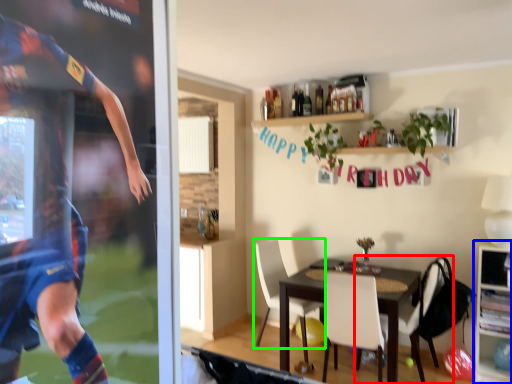
Question: Which object is the farthest from chair (highlighted by a red box)? Choose among these: cabinetry (highlighted by a blue box) or chair (highlighted by a green box).

Choices:
 (A) cabinetry
 (B) chair

Answer: (B)